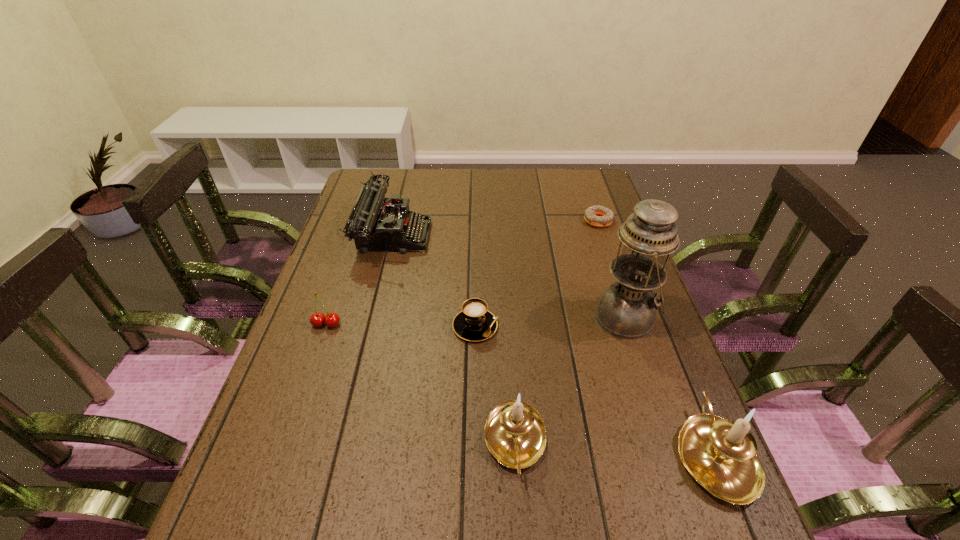
At what (x,y) coordinates should I click in order to perform the action: click on the shorter candle holder. Please return your answer as a coordinate pair (x, y). The image size is (960, 540). Looking at the image, I should click on (515, 434).

You are a GUI agent. You are given a task and a screenshot of the screen. Output one action in this format:
    pyautogui.click(x=<x>, y=<y>)
    Task: Click on the sixth shortest object
    The height and width of the screenshot is (540, 960).
    Given the screenshot: What is the action you would take?
    pyautogui.click(x=720, y=454)

Where is `the taller candle holder`? the taller candle holder is located at coordinates (720, 454).

The height and width of the screenshot is (540, 960). In order to click on doughnut in this screenshot , I will do `click(592, 215)`.

Locate an element on the screen. The height and width of the screenshot is (540, 960). typewriter is located at coordinates (372, 224).

The height and width of the screenshot is (540, 960). I want to click on the tallest object, so click(627, 309).

Identify the location of cherry. click(317, 319).

At what (x,y) coordinates should I click in order to perform the action: click on cappuccino. Please return your answer as a coordinate pair (x, y). The height and width of the screenshot is (540, 960). Looking at the image, I should click on (474, 323).

At what (x,y) coordinates should I click in order to perform the action: click on vacant space situated 0.280m on the handle side of the right candle holder. Please return your answer as a coordinate pair (x, y). The width and height of the screenshot is (960, 540). Looking at the image, I should click on (657, 313).

At what (x,y) coordinates should I click in order to perform the action: click on free space located 0.380m on the handle side of the right candle holder. Please return your answer as a coordinate pair (x, y). Looking at the image, I should click on (646, 287).